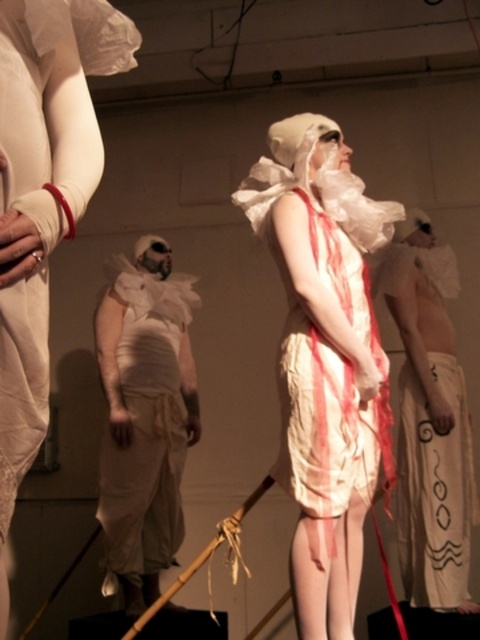
Measure the distance from matte white fabric at center to white textured cloth at center.

matte white fabric at center and white textured cloth at center are 29.83 inches apart from each other.

Who is lower down, matte white fabric at center or white textured cloth at center?

white textured cloth at center is below.

Which is behind, point (304, 292) or point (436, 604)?

The point (436, 604) is behind.

Locate an element on the screen. This screenshot has width=480, height=640. matte white fabric at center is located at coordinates (324, 356).

Does matte white cloth at center have a lesser width compared to white textured cloth at center?

Yes.

Which is in front, point (71, 3) or point (435, 401)?

Point (71, 3) is in front.

What do you see at coordinates (43, 196) in the screenshot? The image size is (480, 640). I see `matte white cloth at center` at bounding box center [43, 196].

This screenshot has height=640, width=480. Identify the location of matte white cloth at center. (43, 196).

Who is positioned more to the right, white crumpled cloth at center or white textured cloth at center?

white textured cloth at center is more to the right.

The height and width of the screenshot is (640, 480). Describe the element at coordinates (144, 416) in the screenshot. I see `white crumpled cloth at center` at that location.

Locate an element on the screen. This screenshot has height=640, width=480. white crumpled cloth at center is located at coordinates (144, 416).